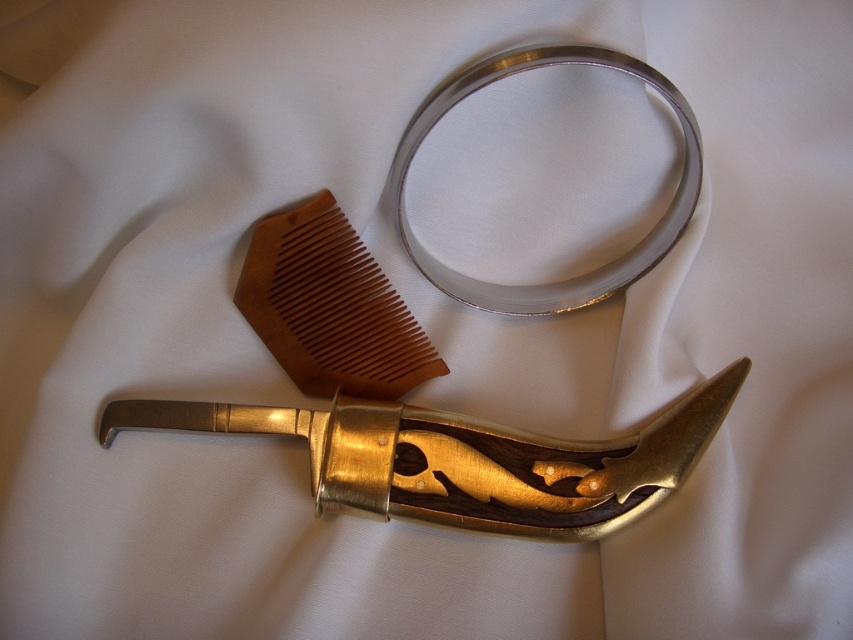
You are organizing a display for a vintage shop and need to place the gold polished metal sword at lower center and the silver metallic ring at upper center on a shelf. Which object requires more shelf space?

The silver metallic ring at upper center requires more shelf space because the gold polished metal sword at lower center occupies less space than it.

You are a jeweler who needs to showcase both the gold polished metal sword at lower center and the silver metallic ring at upper center in a display case. Based on their positions, which item is closer to the front of the display case?

The gold polished metal sword at lower center is closer to the front of the display case because the silver metallic ring at upper center is positioned behind it.